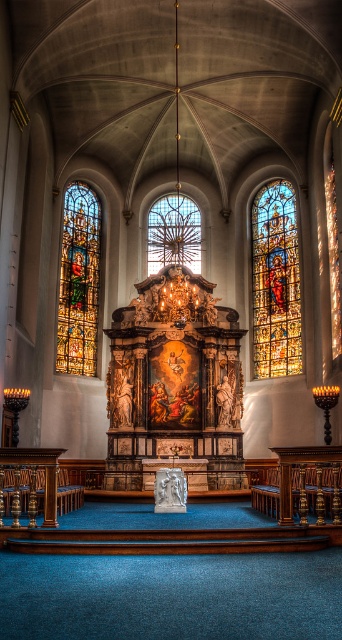
You are standing in the grand church and want to take a photo of the altar. The stained glass window at right is represented by point (x=275, y=282). Where should you position yourself to ensure both the altar and the stained glass window at right are in the frame?

To capture both the altar and the stained glass window at right in your photo, position yourself centrally in the altar area, facing the altar. Since the stained glass window at right is located at point (x=275, y=282), this coordinate places it within the right side of the frame, ensuring both elements are included.